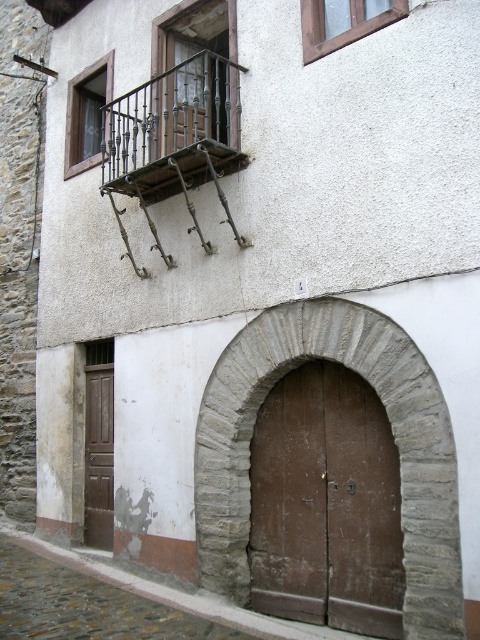
Question: Among these objects, which one is nearest to the camera?

Choices:
 (A) brown wooden door at center
 (B) brown wooden door at lower left
 (C) dark brown wrought iron balcony at upper left
 (D) stone arched doorway at center

Answer: (D)

Question: Which point appears closest to the camera in this image?

Choices:
 (A) pyautogui.click(x=407, y=515)
 (B) pyautogui.click(x=269, y=422)

Answer: (A)

Question: Does dark brown wrought iron balcony at upper left appear over brown wooden door at lower left?

Choices:
 (A) yes
 (B) no

Answer: (A)

Question: Does brown wooden door at center have a lesser width compared to dark brown wrought iron balcony at upper left?

Choices:
 (A) no
 (B) yes

Answer: (B)

Question: Which point is closer to the camera?

Choices:
 (A) brown wooden door at center
 (B) stone arched doorway at center
 (C) brown wooden door at lower left

Answer: (B)

Question: Considering the relative positions of stone arched doorway at center and brown wooden door at center in the image provided, where is stone arched doorway at center located with respect to brown wooden door at center?

Choices:
 (A) above
 (B) below

Answer: (A)